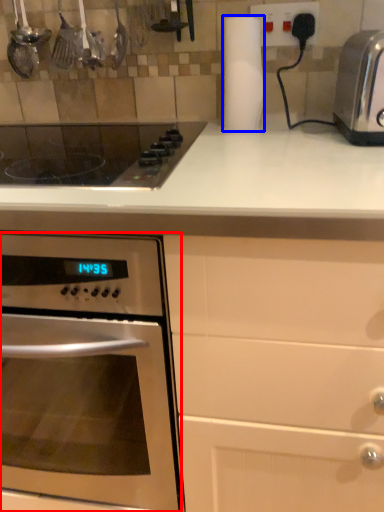
Question: Which point is further to the camera, oven (highlighted by a red box) or paper towel (highlighted by a blue box)?

Choices:
 (A) oven
 (B) paper towel

Answer: (B)